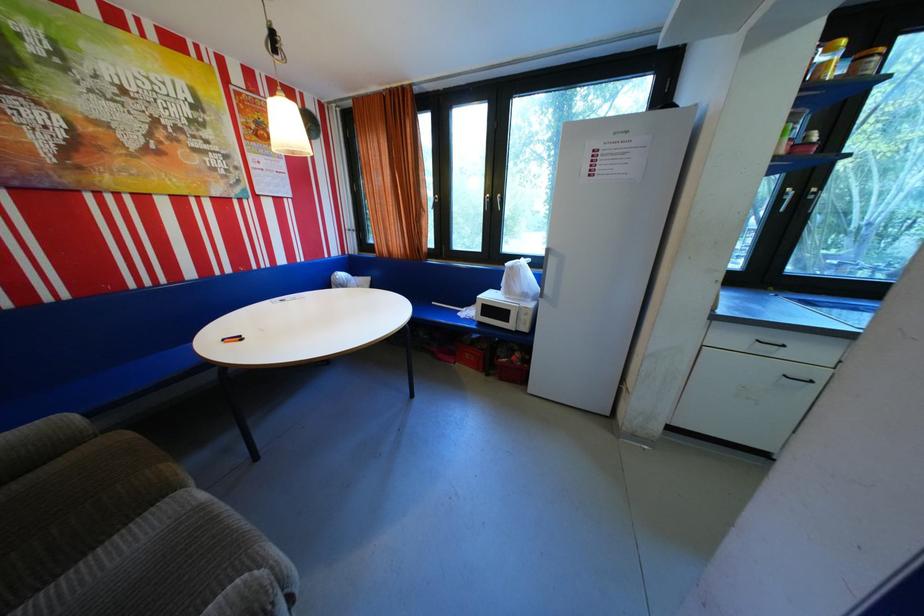
Where would you pull the white window handle? Please return your answer as a coordinate pair (x, y).

(493, 201)